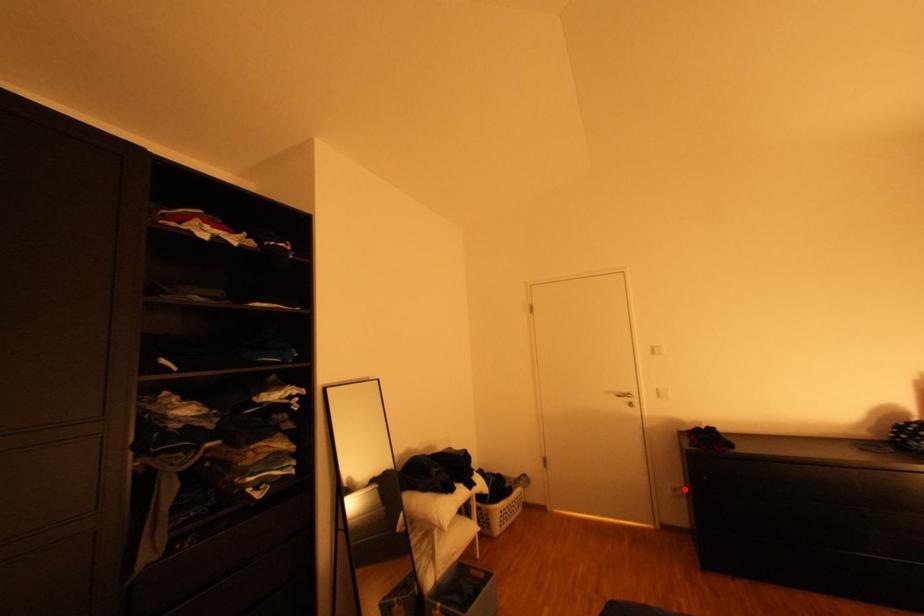
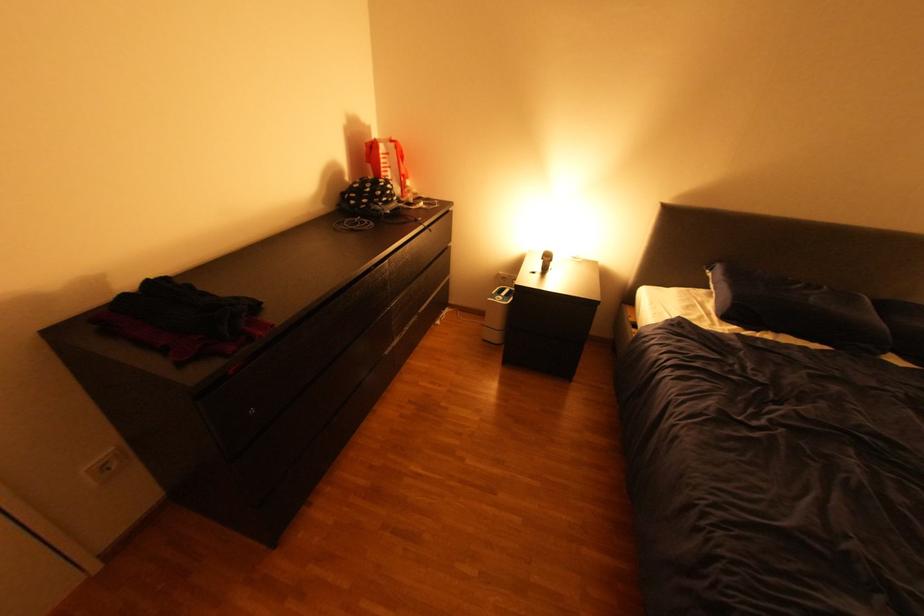
Question: I am providing you with two images of the same scene from different viewpoints. A red point is marked on the first image. Is the red point's position out of view in image 2?

Choices:
 (A) Yes
 (B) No

Answer: (B)